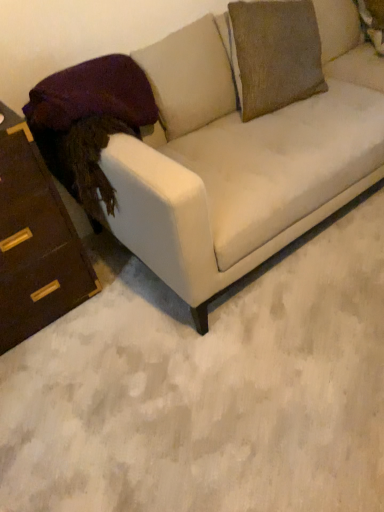
Locate an element on the screen. The image size is (384, 512). vacant region in front of brown wood chest of drawers at left is located at coordinates (60, 371).